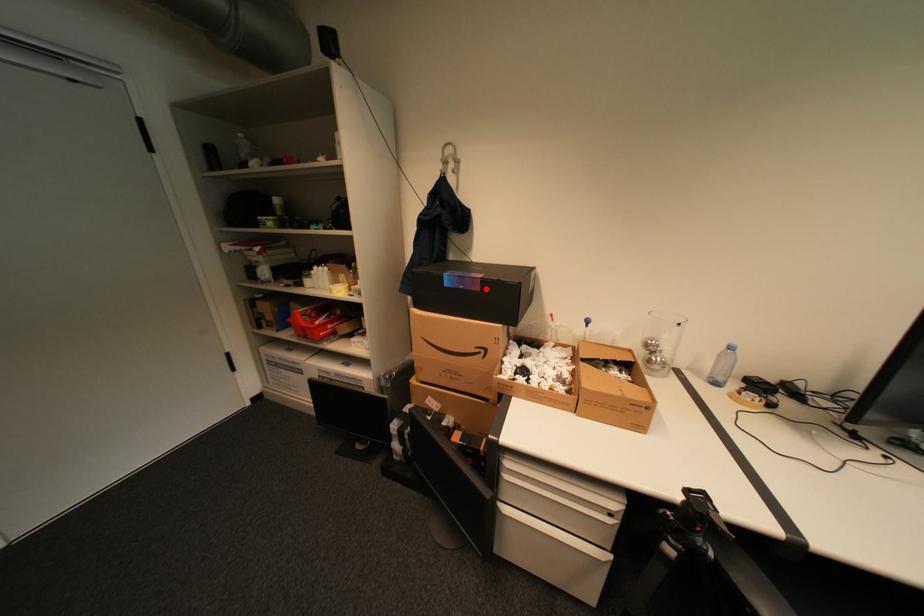
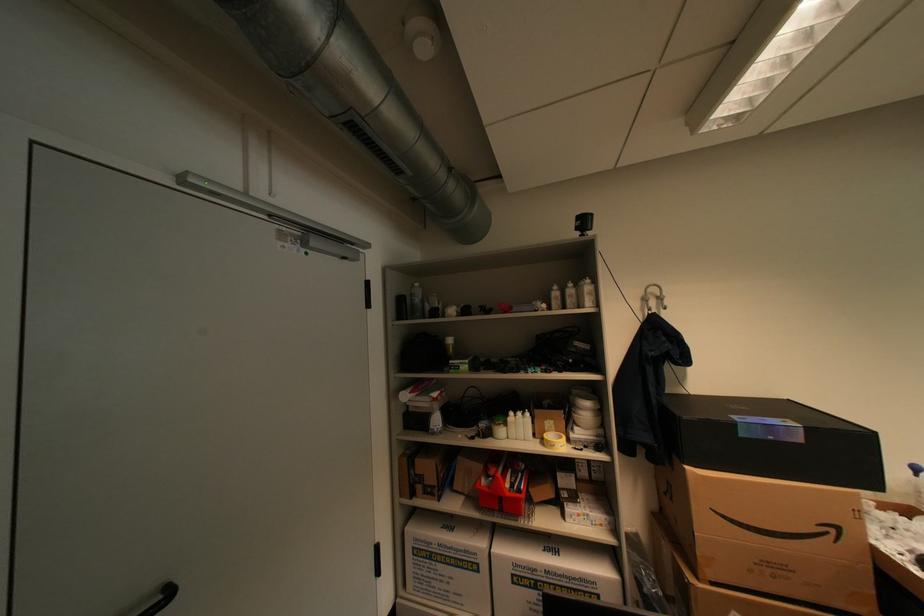
Find the pixel in the second image that matches the highlighted location in the first image.

(808, 440)